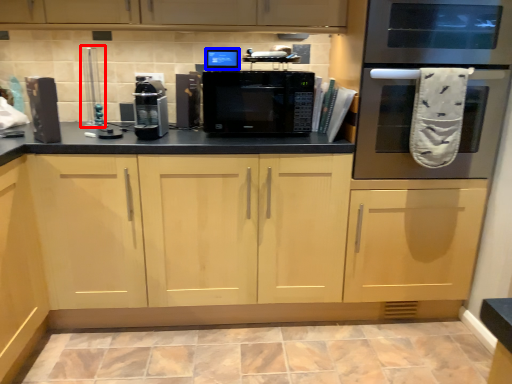
Question: Which point is further to the camera, appliance (highlighted by a red box) or appliance (highlighted by a blue box)?

Choices:
 (A) appliance
 (B) appliance

Answer: (A)